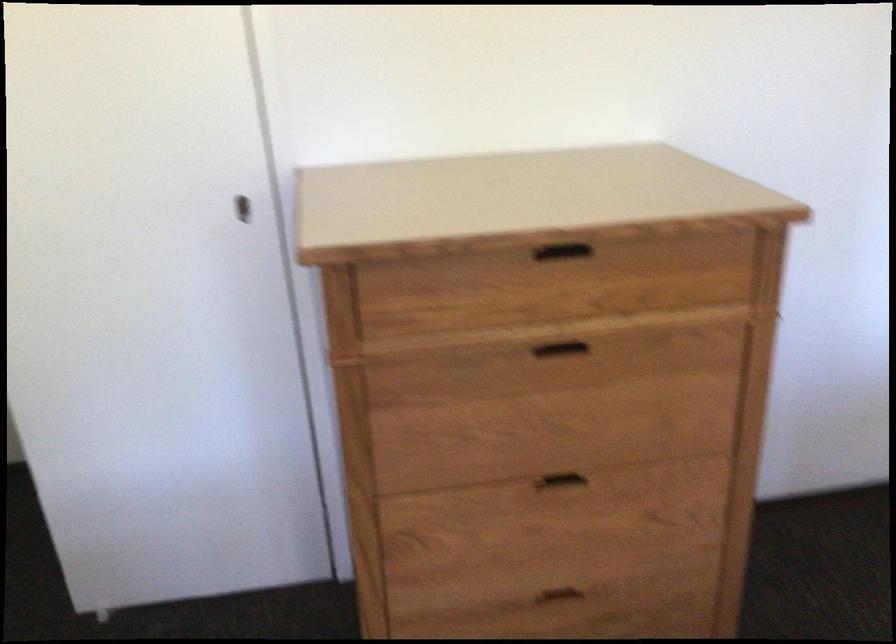
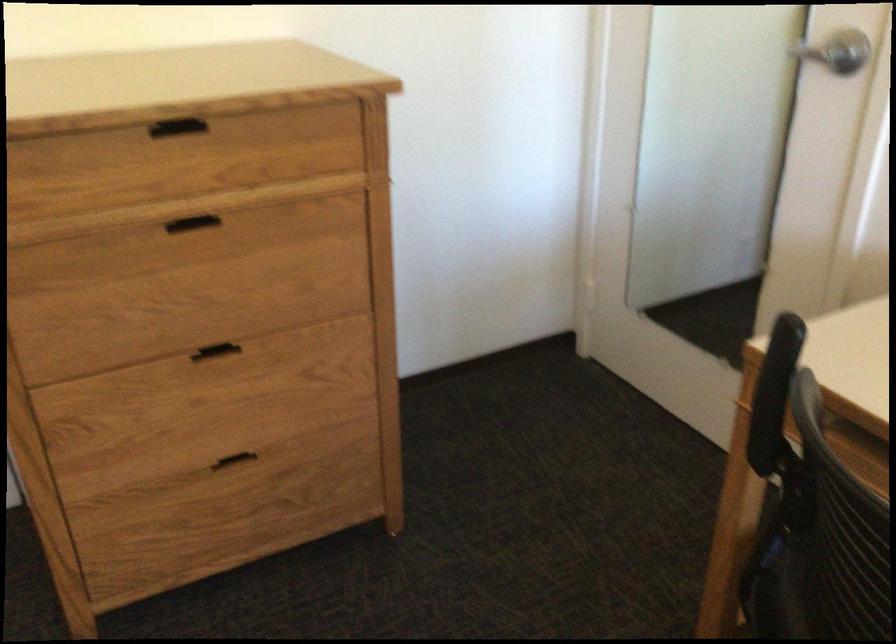
Where in the second image is the point corresponding to point (580, 348) from the first image?

(211, 227)